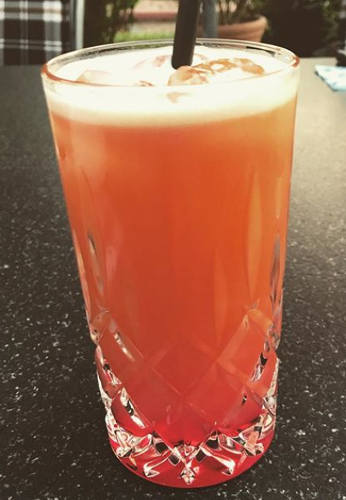
You are a GUI agent. You are given a task and a screenshot of the screen. Output one action in this format:
    pyautogui.click(x=<x>, y=<y>)
    Task: Click on the table
    The width and height of the screenshot is (346, 500).
    Given the screenshot: What is the action you would take?
    pos(92,452), pos(217,498)